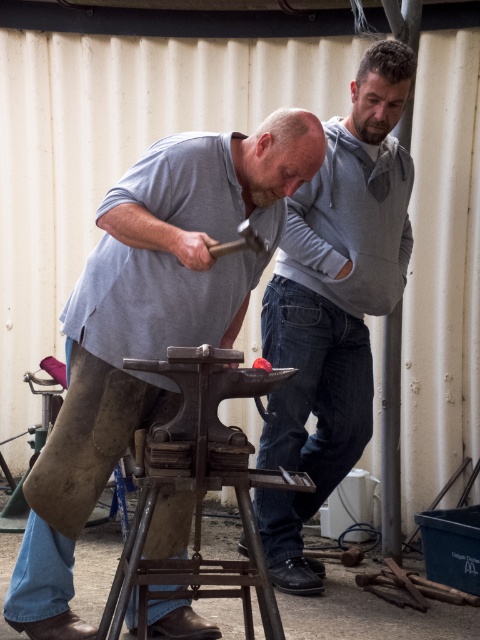
You are a tailor measuring shirts for alterations. You have a 12 inch wide table. Which shirt, the matte gray shirt at center or the gray cotton shirt at upper center, can you place on the table without overlapping the edges?

The matte gray shirt at center is wider than the gray cotton shirt at upper center, so the gray cotton shirt at upper center can fit on the 12 inch wide table without overlapping the edges while the matte gray shirt at center may not fit.

You are standing in the workshop and want to reach the point marked as point (41, 552). If you can move 10 feet per minute, how long will it take you to reach it?

The point (41, 552) is 9.79 feet away. Since you can move 10 feet per minute, it will take approximately 0.979 minutes, which is about 59 seconds, to reach it.